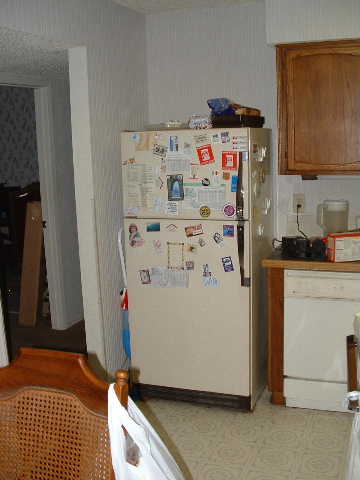
Where is `white refridgerator`? This screenshot has height=480, width=360. white refridgerator is located at coordinates (235, 304).